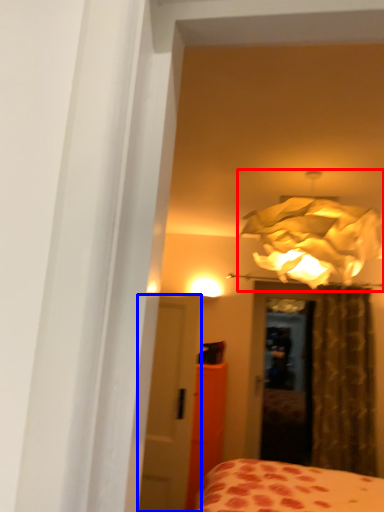
Question: Among these objects, which one is nearest to the camera, lamp (highlighted by a red box) or door (highlighted by a blue box)?

Choices:
 (A) lamp
 (B) door

Answer: (A)